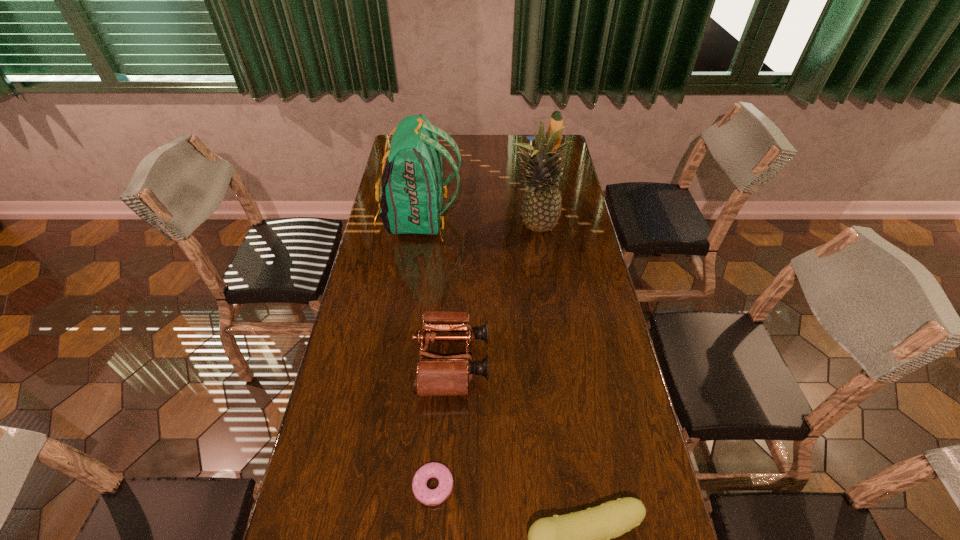
The height and width of the screenshot is (540, 960). What are the coordinates of `free point between the third shortest object and the farthest object` in the screenshot? It's located at (501, 269).

In order to click on empty location between the farthest object and the shortest object in this screenshot , I will do `click(492, 331)`.

Identify the location of free spot between the detergent and the doughnut. (492, 331).

Find the location of a particular element. This screenshot has height=540, width=960. free space between the shortest object and the pineapple is located at coordinates (484, 357).

Where is `empty space between the doughnut and the pineapple`? The image size is (960, 540). empty space between the doughnut and the pineapple is located at coordinates (484, 357).

At what (x,y) coordinates should I click in order to perform the action: click on object identified as the second closest to the farthest object. Please return your answer as a coordinate pair (x, y). Looking at the image, I should click on (412, 189).

The height and width of the screenshot is (540, 960). Find the location of `object identified as the fourth closest to the cucumber`. object identified as the fourth closest to the cucumber is located at coordinates (412, 189).

Identify the location of free region that satisfies the following two spatial constraints: 1. on the back of the backpack; 2. on the right side of the doughnut. Image resolution: width=960 pixels, height=540 pixels. (379, 486).

This screenshot has width=960, height=540. In order to click on vacant space that satisfies the following two spatial constraints: 1. on the back of the pineapple; 2. on the left side of the backpack in this screenshot , I will do `click(419, 228)`.

Identify the location of free location that satisfies the following two spatial constraints: 1. on the back of the backpack; 2. on the right side of the pineapple. (419, 228).